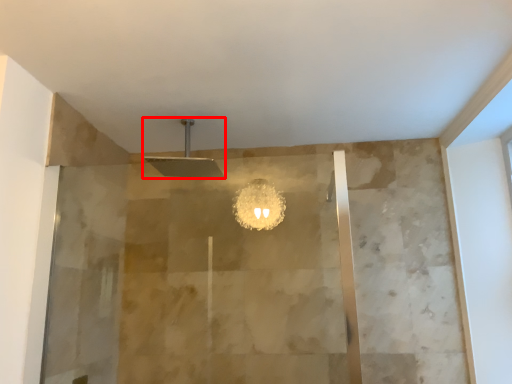
Question: From the image's perspective, what is the correct spatial positioning of shower (annotated by the red box) in reference to screen door?

Choices:
 (A) above
 (B) below

Answer: (A)